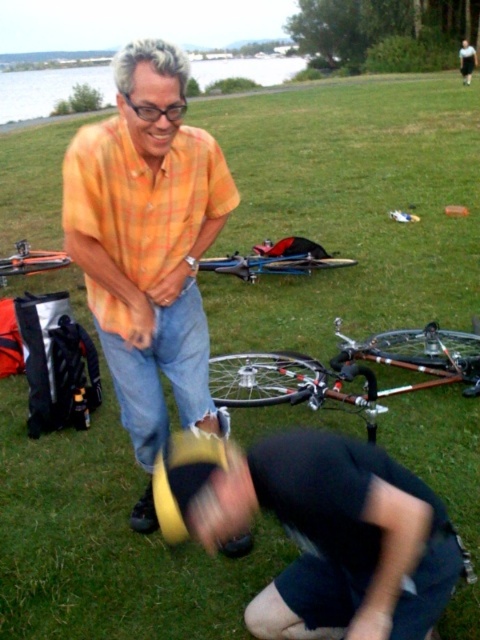
Describe the element at coordinates (319, 522) in the screenshot. I see `dark gray fabric squat at lower center` at that location.

Which of these two, dark gray fabric squat at lower center or brushed metal bicycle at center, stands taller?

Standing taller between the two is dark gray fabric squat at lower center.

Find the location of a particular element. The width and height of the screenshot is (480, 640). dark gray fabric squat at lower center is located at coordinates (319, 522).

Does orange plaid shirt at center lie behind brushed metal bicycle at center?

No, it is in front of brushed metal bicycle at center.

Does orange plaid shirt at center lie in front of brushed metal bicycle at center?

That is True.

Is point (197, 147) closer to viewer compared to point (7, 266)?

Yes.

This screenshot has height=640, width=480. I want to click on orange plaid shirt at center, so click(147, 241).

Between point (294, 588) and point (445, 369), which one is positioned behind?

Point (445, 369)

Is dark gray fabric squat at lower center above silver metallic bicycle at center?

No, dark gray fabric squat at lower center is not above silver metallic bicycle at center.

Describe the element at coordinates (319, 522) in the screenshot. I see `dark gray fabric squat at lower center` at that location.

This screenshot has width=480, height=640. In order to click on dark gray fabric squat at lower center in this screenshot , I will do `click(319, 522)`.